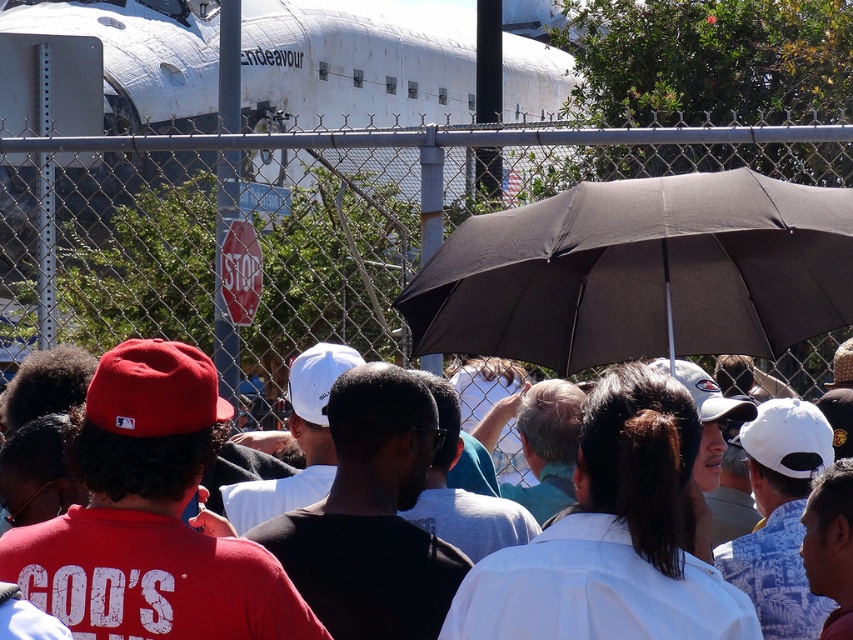
You are standing at point (757, 260) and want to walk to the Endeavour spacecraft. Is there an unobstructed path from your current position to the spacecraft, considering the location of point (549, 362)?

Point (549, 362) is behind point (757, 260), so there is an unobstructed path to the spacecraft as long as there are no other obstacles between you and the spacecraft beyond point (549, 362).